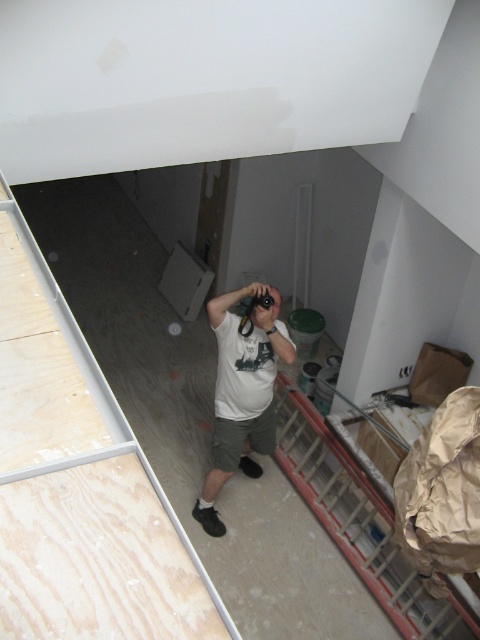
You are a construction worker standing at the camera position. You need to reach the unfinished ceiling to apply more paint. The ladder you have is the metallic red ladder at lower right. Can you safely reach the ceiling with this ladder?

The metallic red ladder at lower right is 3.59 meters from camera. Since the ladder is positioned at that distance, it might not be close enough for you to safely reach the ceiling from the camera position. You should move closer to the ladder first.